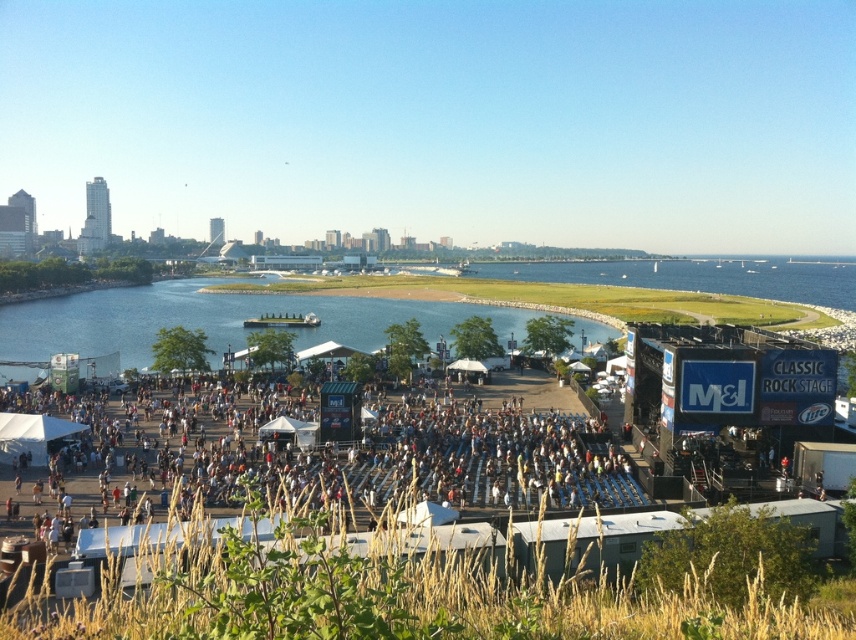
Between white fabric tent at center and blue water at center, which one appears on the right side from the viewer's perspective?

From the viewer's perspective, white fabric tent at center appears more on the right side.

Which is in front, point (194, 474) or point (108, 292)?

Point (194, 474) is more forward.

Find the location of a particular element. Image resolution: width=856 pixels, height=640 pixels. white fabric tent at center is located at coordinates (391, 458).